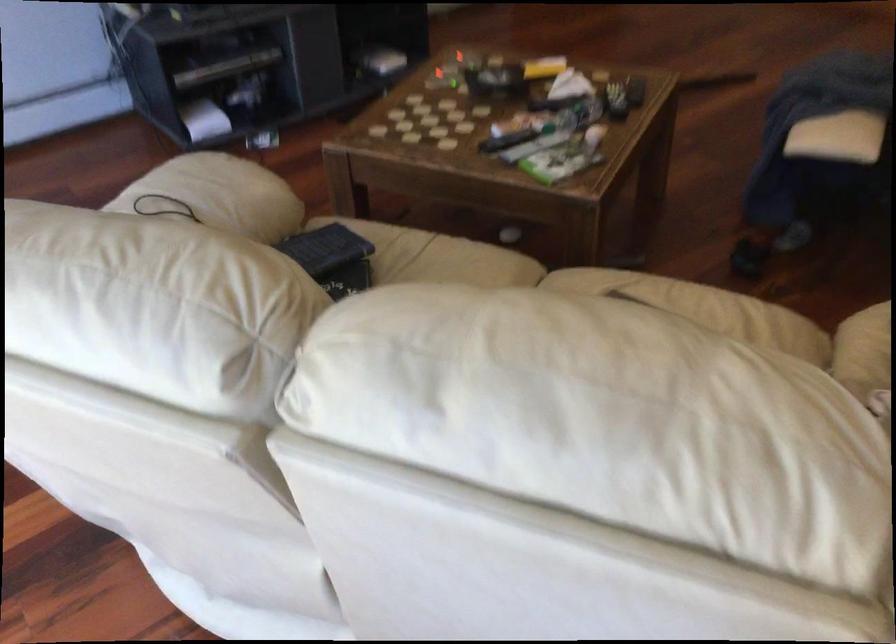
You are a GUI agent. You are given a task and a screenshot of the screen. Output one action in this format:
    pyautogui.click(x=<x>, y=<y>)
    Task: Click on the small black keyboard
    The height and width of the screenshot is (644, 896).
    Given the screenshot: What is the action you would take?
    pyautogui.click(x=325, y=249)